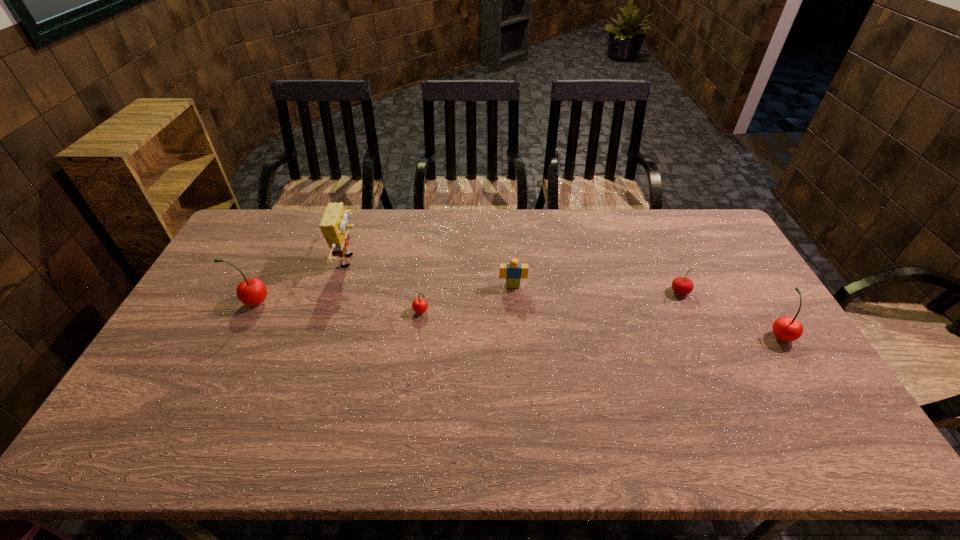
The height and width of the screenshot is (540, 960). Find the location of `vacant region between the nearest object and the fourth object from right to left`. vacant region between the nearest object and the fourth object from right to left is located at coordinates (600, 323).

You are a GUI agent. You are given a task and a screenshot of the screen. Output one action in this format:
    pyautogui.click(x=<x>, y=<y>)
    Task: Click on the vacant area that lies between the leftmost cherry and the sponge
    The height and width of the screenshot is (540, 960).
    Given the screenshot: What is the action you would take?
    pyautogui.click(x=301, y=281)

Where is `free space between the fifth object from right to left and the leftmost object`? Image resolution: width=960 pixels, height=540 pixels. free space between the fifth object from right to left and the leftmost object is located at coordinates (301, 281).

At what (x,y) coordinates should I click in order to perform the action: click on the second closest object to the fourth object from right to left. Please return your answer as a coordinate pair (x, y). This screenshot has width=960, height=540. Looking at the image, I should click on (513, 272).

Identify which object is located as the second nearest to the nearest cherry. Please provide its 2D coordinates. Your answer should be formatted as a tuple, i.e. [(x, y)], where the tuple contains the x and y coordinates of a point satisfying the conditions above.

[(513, 272)]

At what (x,y) coordinates should I click in order to perform the action: click on the third closest cherry to the leftmost cherry. Please return your answer as a coordinate pair (x, y). The width and height of the screenshot is (960, 540). Looking at the image, I should click on (785, 328).

Point out which cherry is positioned as the second nearest to the third shortest cherry. Please provide its 2D coordinates. Your answer should be formatted as a tuple, i.e. [(x, y)], where the tuple contains the x and y coordinates of a point satisfying the conditions above.

[(419, 305)]

I want to click on vacant area that satisfies the following two spatial constraints: 1. on the back side of the fifth object from left to right; 2. on the face of the fifth object from right to left, so click(x=666, y=261).